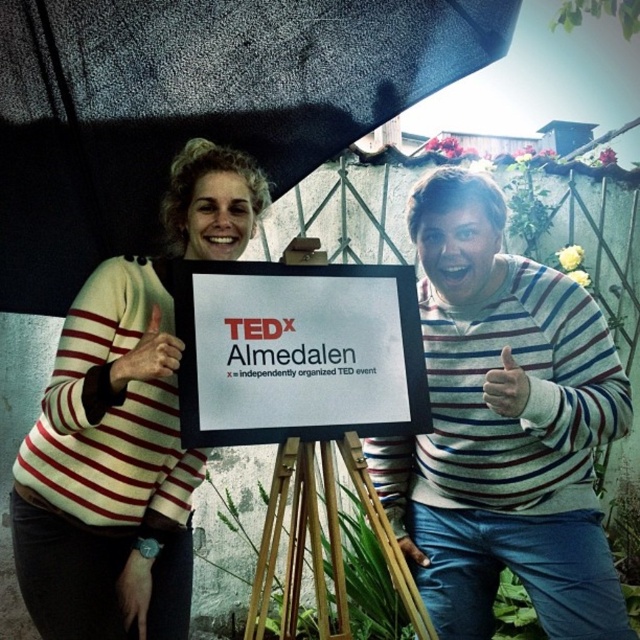
You are designing a poster for an event and want to ensure the text is readable. You have a striped sweater at left and a white paper sign at center in your design. Which object should you make larger to maintain readability?

The striped sweater at left is taller than the white paper sign at center, so you should make the white paper sign at center larger to ensure its text remains readable.